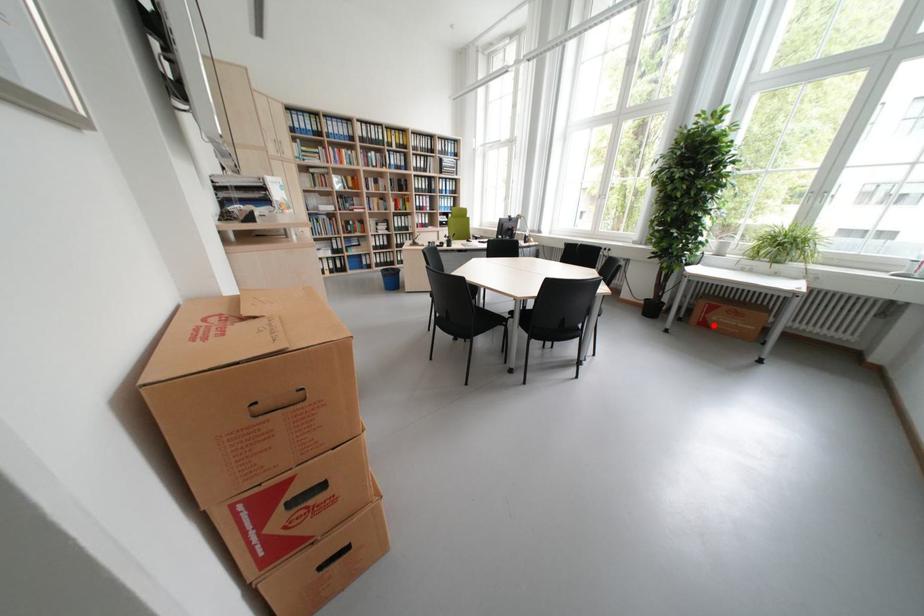
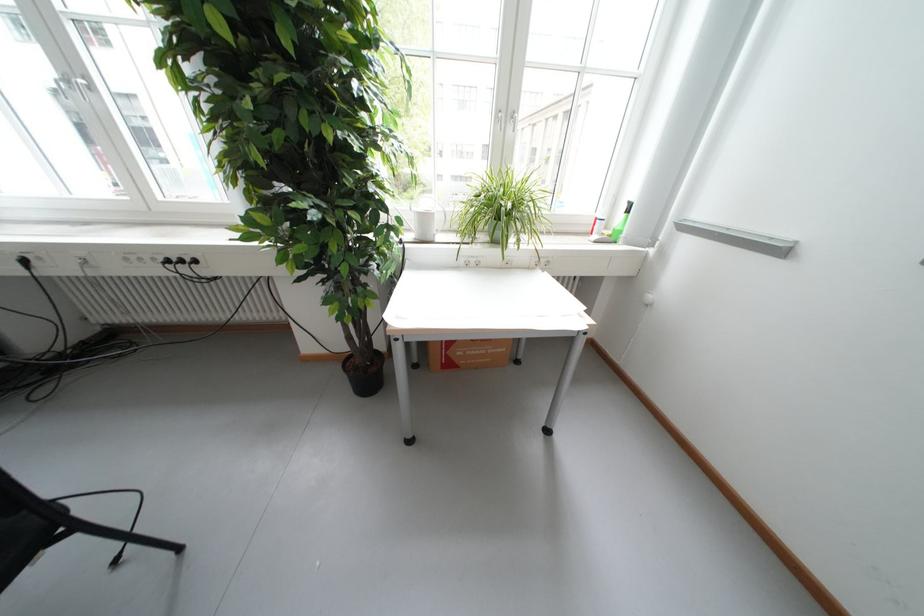
Locate, in the second image, the point that corresponds to the highlighted location in the first image.

(458, 366)